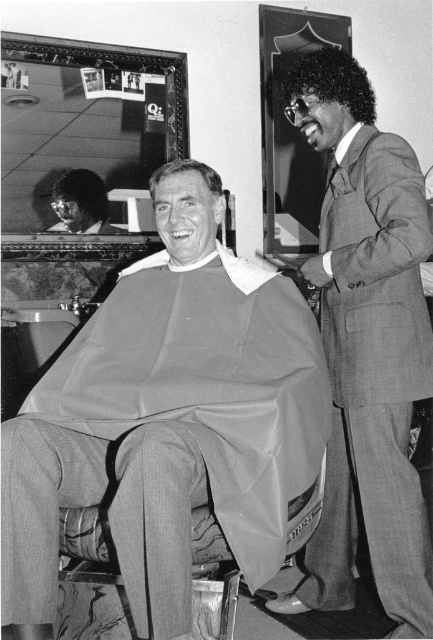
Is point (104, 461) farther from viewer compared to point (299, 99)?

That is False.

Where is `gray fabric at center`? The height and width of the screenshot is (640, 433). gray fabric at center is located at coordinates (168, 424).

The width and height of the screenshot is (433, 640). Describe the element at coordinates (81, 204) in the screenshot. I see `shiny black hair at upper left` at that location.

Is shiny black hair at upper left to the left of smooth gray hair at center from the viewer's perspective?

Indeed, shiny black hair at upper left is positioned on the left side of smooth gray hair at center.

Is point (78, 200) behind point (188, 172)?

That is True.

Where is `shiny black hair at upper left`? shiny black hair at upper left is located at coordinates (81, 204).

Is gray fabric at center shorter than smooth suit at right?

Correct, gray fabric at center is not as tall as smooth suit at right.

What do you see at coordinates (168, 424) in the screenshot?
I see `gray fabric at center` at bounding box center [168, 424].

Which is behind, point (206, 216) or point (306, 564)?

Positioned behind is point (306, 564).

Locate an element on the screen. Image resolution: width=433 pixels, height=640 pixels. gray fabric at center is located at coordinates [x=168, y=424].